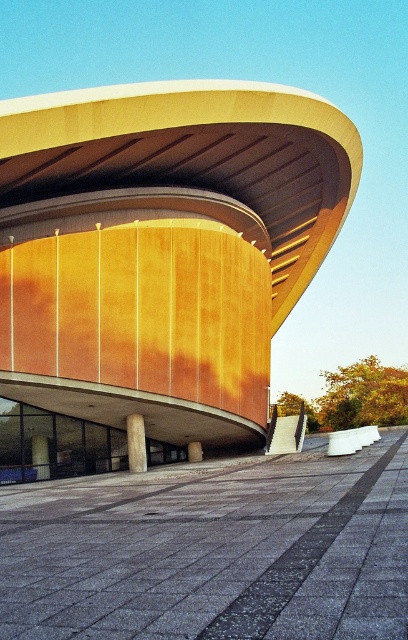
Looking at this image, you are an architect planning to install a new light fixture between the wooden paneling at center and the wooden pillar at center. The light fixture requires 10 feet of space on all sides to avoid obstruction. Is there enough space between them to safely install the light fixture?

The wooden paneling at center and wooden pillar at center are 31.04 feet apart. Since the light fixture needs 10 feet of space on each side, totaling 20 feet, there is sufficient space between them as 31.04 feet is greater than 20 feet.

You are an architect planning to install a new light fixture between the smooth wood pillar at center and the nearest vertical light fixture. The new fixture requires a minimum of 10 feet of space to be safely installed. Is there enough space between them?

The smooth wood pillar at center and the nearest vertical light fixture are 90.30 feet apart, so yes, there is more than enough space to install the new fixture safely.

You are an architect evaluating the structural integrity of the building. You notice two pillars supporting the roof structure. The smooth wood pillar at center and the smooth concrete pillar at center. Which pillar is more likely to provide greater height support for the roof? Please explain your reasoning based on their positions and the scene description.

The smooth wood pillar at center is much taller than the smooth concrete pillar at center, so it can provide greater height support for the roof.